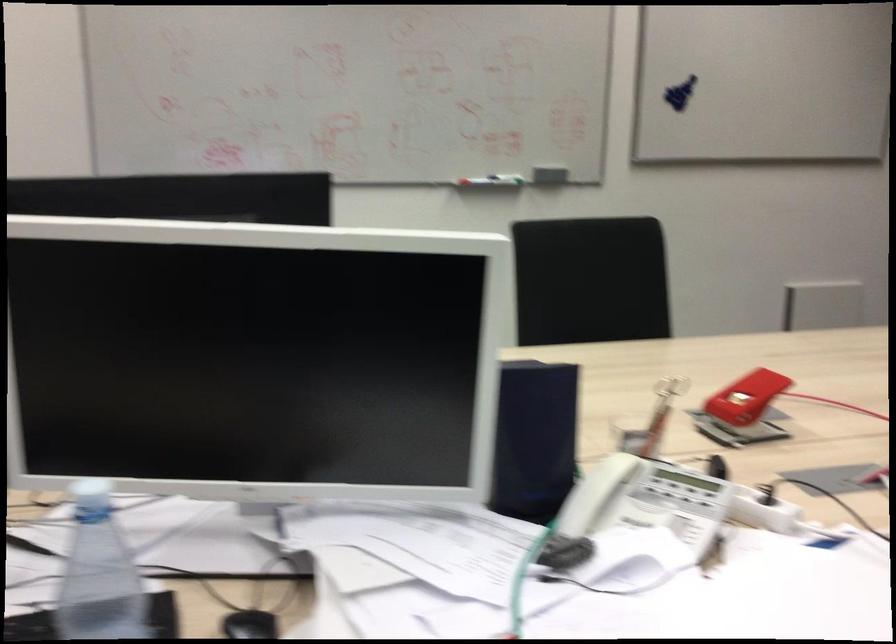
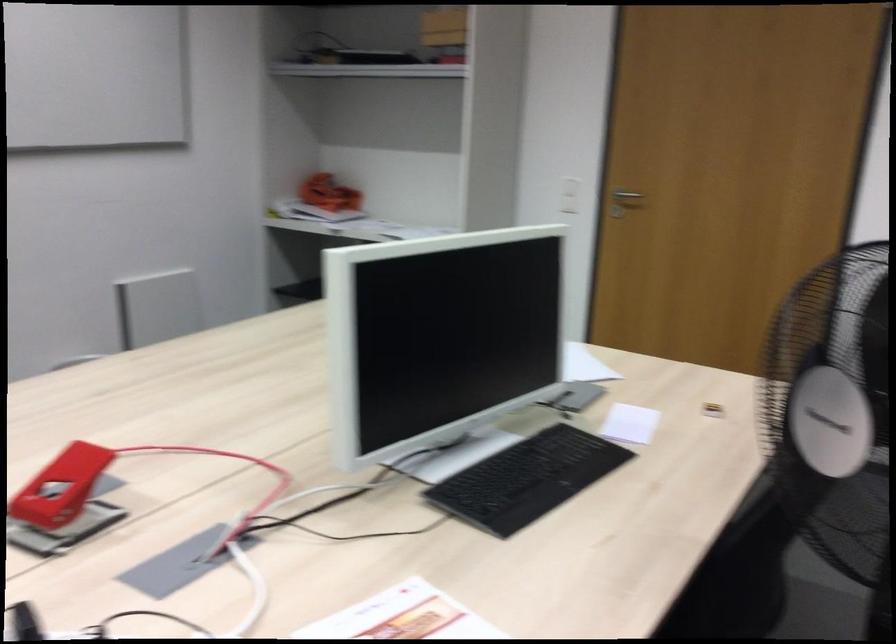
Question: The images are taken continuously from a first-person perspective. In which direction is your viewpoint rotating?

Choices:
 (A) Left
 (B) Right
 (C) Up
 (D) Down

Answer: (B)